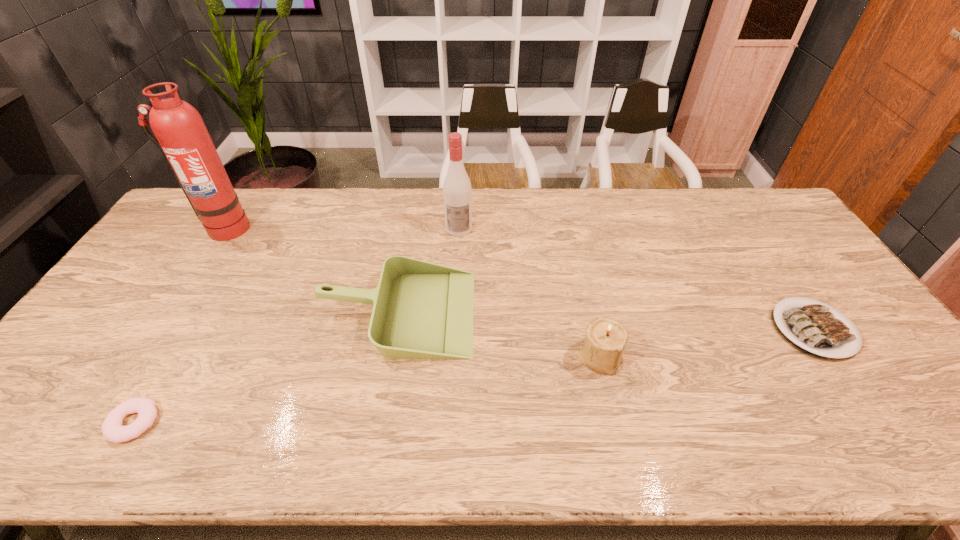
Find the location of a particular element. This screenshot has height=540, width=960. vacant space that satisfies the following two spatial constraints: 1. on the label side of the rightmost object; 2. on the left side of the tallest object is located at coordinates [x=158, y=329].

In order to click on free spot that satisfies the following two spatial constraints: 1. on the label of the rightmost object; 2. on the left side of the fifth shortest object in this screenshot , I will do coord(454,329).

You are a GUI agent. You are given a task and a screenshot of the screen. Output one action in this format:
    pyautogui.click(x=<x>, y=<y>)
    Task: Click on the free space in the image that satisfies the following two spatial constraints: 1. on the label of the second tallest object; 2. on the scoop of the dustpan
    The width and height of the screenshot is (960, 540).
    Given the screenshot: What is the action you would take?
    pyautogui.click(x=454, y=312)

Identify the location of free space that satisfies the following two spatial constraints: 1. on the back side of the doughnut; 2. on the left side of the rightmost object. (189, 329).

This screenshot has height=540, width=960. I want to click on vacant point that satisfies the following two spatial constraints: 1. on the scoop of the rightmost object; 2. on the left side of the dustpan, so click(395, 329).